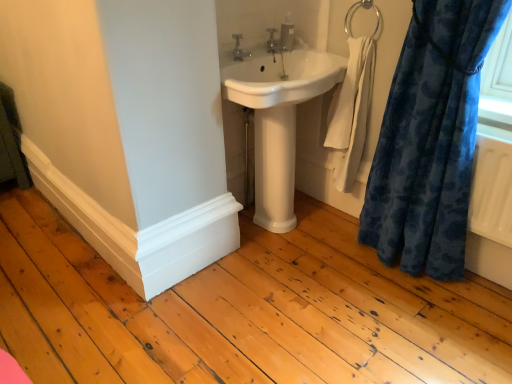
Question: In the image, is velvety blue curtain at right positioned in front of or behind white glossy pedestal at center?

Choices:
 (A) behind
 (B) front

Answer: (B)

Question: Based on their sizes in the image, would you say velvety blue curtain at right is bigger or smaller than white glossy pedestal at center?

Choices:
 (A) big
 (B) small

Answer: (A)

Question: Which is nearer to the satin silver soap dispenser at upper center?

Choices:
 (A) velvety blue curtain at right
 (B) matte silver faucet at upper center, the second tap positioned from the front
 (C) white glossy pedestal at center
 (D) silver metallic tap at upper center, the 1th tap when ordered from left to right
 (E) white cotton towel at right

Answer: (B)

Question: Which object is the farthest from the white glossy pedestal at center?

Choices:
 (A) white glossy sink at center
 (B) silver metallic towel bar at upper right
 (C) white cotton towel at right
 (D) matte silver faucet at upper center, the second tap positioned from the front
 (E) silver metallic tap at upper center, the 1th tap when ordered from left to right

Answer: (B)